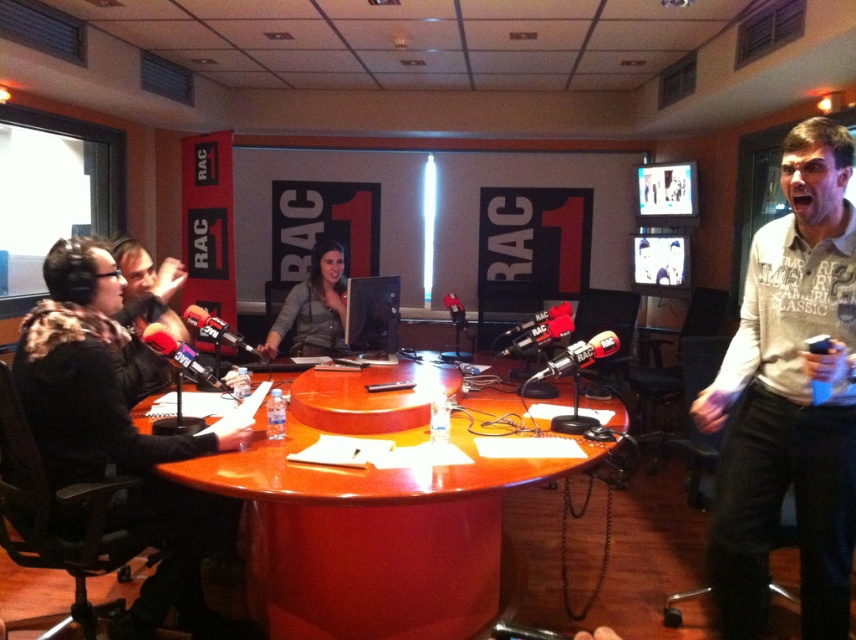
Question: Can you confirm if matte black microphone at center is smaller than metallic black microphone at center?

Choices:
 (A) no
 (B) yes

Answer: (B)

Question: Is white cotton shirt at right positioned at the back of metallic black microphone at center?

Choices:
 (A) yes
 (B) no

Answer: (B)

Question: Can you confirm if black matte microphone at center is positioned to the left of metallic black microphone at center?

Choices:
 (A) yes
 (B) no

Answer: (B)

Question: Estimate the real-world distances between objects in this image. Which object is farther from the black matte microphone at center?

Choices:
 (A) black fur coat at left
 (B) matte black microphone at center

Answer: (A)

Question: Which object is the farthest from the matte black microphone at left?

Choices:
 (A) matte black microphone at center
 (B) matte gray shirt at center
 (C) metallic black microphone at center

Answer: (B)

Question: Estimate the real-world distances between objects in this image. Which object is closer to the white cotton shirt at right?

Choices:
 (A) glossy wood table at center
 (B) matte black microphone at center
 (C) metallic black microphone at center

Answer: (A)